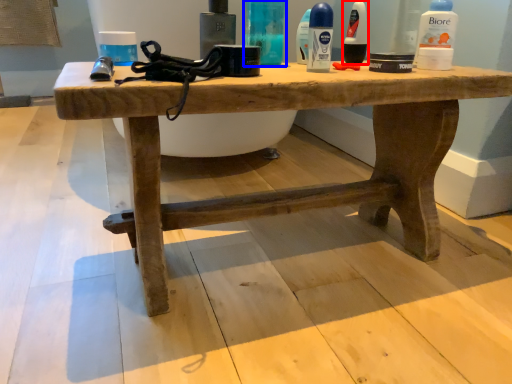
Question: Which object is closer to the camera taking this photo, toiletry (highlighted by a red box) or toiletry (highlighted by a blue box)?

Choices:
 (A) toiletry
 (B) toiletry

Answer: (B)